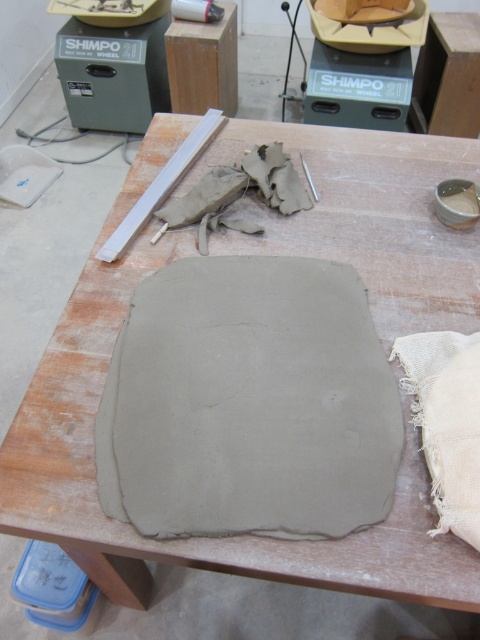
You are a pottery student who needs to place a 15cm wide tool on your workspace. The gray clay pad at center and the white burlap cloth at lower right are both available surfaces. Which surface can accommodate the tool without overlapping?

The gray clay pad at center has a larger width than the white burlap cloth at lower right, so the gray clay pad at center can accommodate the 15cm wide tool without overlapping.

You are a pottery student who wants to reach the point at coordinates point (207,456). You have a tool that can extend up to 30 inches. Can your tool reach the point?

The distance between point (207,456) and the camera is 31.96 inches, which is longer than the tool can extend. Therefore, the tool cannot reach the point.

You are a pottery student who needs to place a 10 inch long tool between the gray clay pad at center and the white burlap cloth at lower right. Is there enough space between them to fit the tool?

The distance between the gray clay pad at center and the white burlap cloth at lower right is 7.53 inches. Since the tool is 10 inches long, it cannot fit in the space between them.